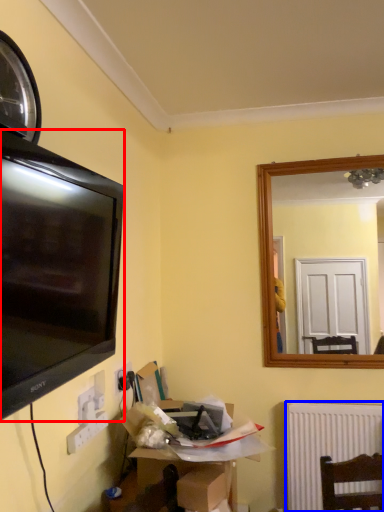
Question: Which of the following is the closest to the observer, television (highlighted by a red box) or radiator (highlighted by a blue box)?

Choices:
 (A) television
 (B) radiator

Answer: (A)